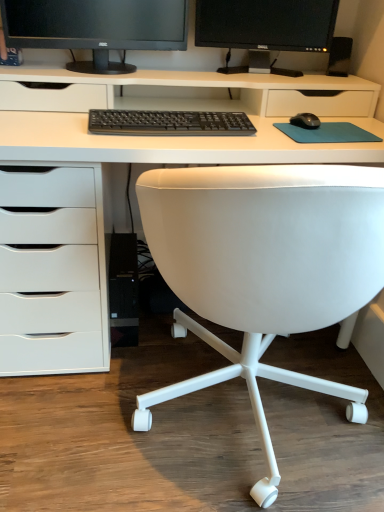
Question: Based on their sizes in the image, would you say white leather chair at center is bigger or smaller than black plastic speaker at upper right?

Choices:
 (A) big
 (B) small

Answer: (A)

Question: Considering their positions, is white leather chair at center located in front of or behind black plastic speaker at upper right?

Choices:
 (A) behind
 (B) front

Answer: (B)

Question: Estimate the real-world distances between objects in this image. Which object is farther from the black plastic keyboard at center?

Choices:
 (A) black glossy monitor at upper center, the 1th computer monitor in the right-to-left sequence
 (B) black matte mouse at right
 (C) white leather chair at center
 (D) teal fabric mousepad at center
 (E) white matte desk at center

Answer: (A)

Question: Based on their relative distances, which object is farther from the black plastic speaker at upper right?

Choices:
 (A) black matte monitor at upper center, the 1th computer monitor when ordered from left to right
 (B) white leather chair at center
 (C) black matte mouse at right
 (D) teal fabric mousepad at center
 (E) black plastic keyboard at center

Answer: (B)